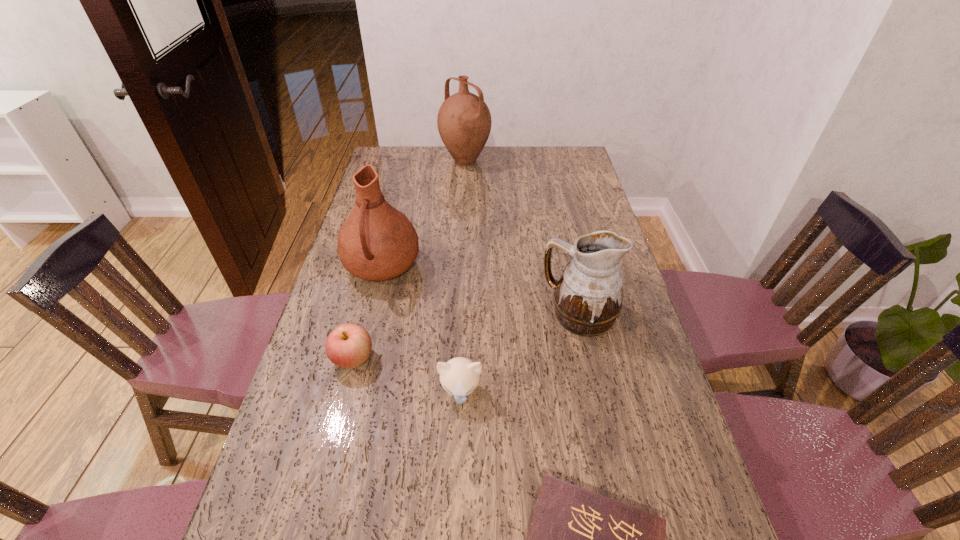
The image size is (960, 540). What are the coordinates of `blank space located from the spout of the rightmost pitcher` in the screenshot? It's located at (457, 314).

Image resolution: width=960 pixels, height=540 pixels. Identify the location of free space located on the face of the kitten. (457, 502).

Identify the location of vacant space situated on the back of the apple. (363, 321).

Image resolution: width=960 pixels, height=540 pixels. I want to click on object positioned at the far edge, so click(x=464, y=122).

Identify the location of pitcher present at the left edge. (376, 242).

What are the coordinates of `apple at the left edge` in the screenshot? It's located at (349, 345).

Where is `object at the right edge`? object at the right edge is located at coordinates [x=588, y=297].

This screenshot has height=540, width=960. In order to click on blank space at the far edge in this screenshot , I will do `click(488, 151)`.

In the image, there is a desktop. Identify the location of vacant space at the left edge. (402, 195).

The height and width of the screenshot is (540, 960). What are the coordinates of `vacant area at the right edge` in the screenshot? It's located at (664, 479).